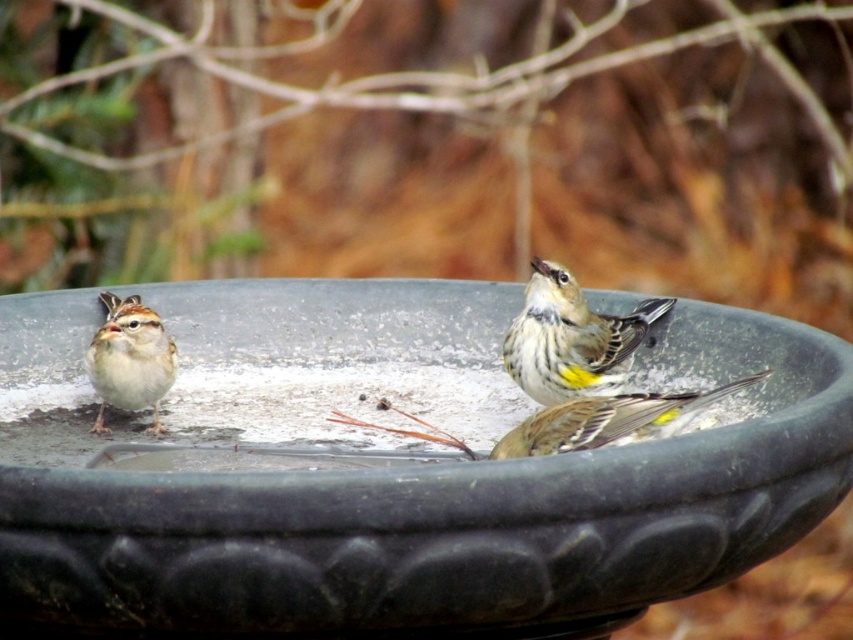
Can you confirm if yellow-green textured bird at center is thinner than yellow-green speckled feathers at center?

Correct, yellow-green textured bird at center's width is less than yellow-green speckled feathers at center's.

Consider the image. Who is positioned more to the left, yellow-green textured bird at center or yellow-green speckled feathers at center?

yellow-green textured bird at center

Between point (566, 349) and point (635, 401), which one is positioned behind?

The point (566, 349) is more distant.

Locate an element on the screen. This screenshot has width=853, height=640. yellow-green textured bird at center is located at coordinates (572, 339).

Who is positioned more to the left, black matte bird bath at center or white fluffy sparrow at left?

white fluffy sparrow at left

From the picture: Is black matte bird bath at center shorter than white fluffy sparrow at left?

In fact, black matte bird bath at center may be taller than white fluffy sparrow at left.

Does point (78, 474) lie behind point (149, 372)?

No, (78, 474) is in front of (149, 372).

This screenshot has width=853, height=640. Find the location of `black matte bird bath at center`. black matte bird bath at center is located at coordinates (389, 468).

Who is higher up, black matte bird bath at center or yellow-green speckled feathers at center?

Positioned higher is yellow-green speckled feathers at center.

Is black matte bird bath at center wider than yellow-green speckled feathers at center?

Indeed, black matte bird bath at center has a greater width compared to yellow-green speckled feathers at center.

Is point (434, 332) farther from viewer compared to point (612, 426)?

Yes, point (434, 332) is behind point (612, 426).

Where is `black matte bird bath at center`? This screenshot has height=640, width=853. black matte bird bath at center is located at coordinates (389, 468).